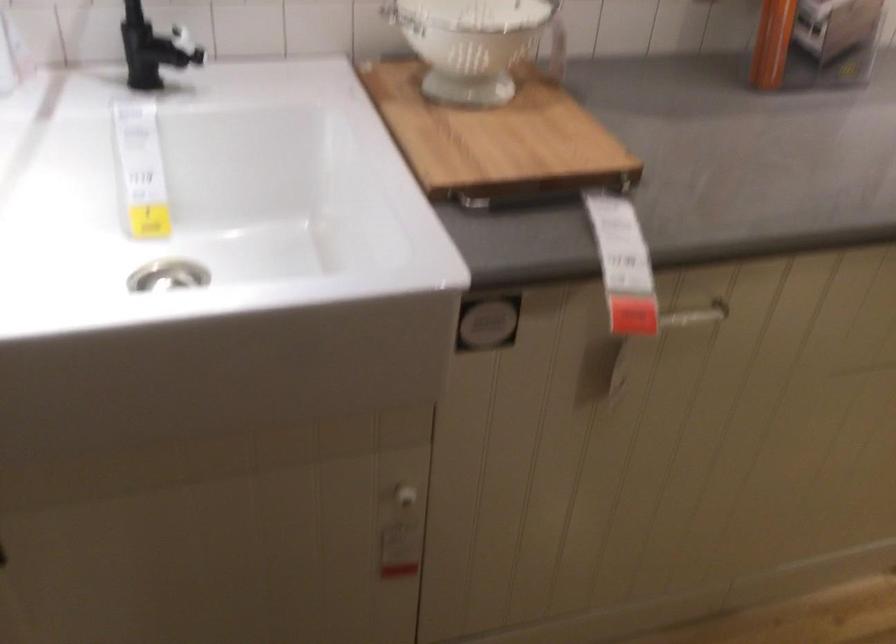
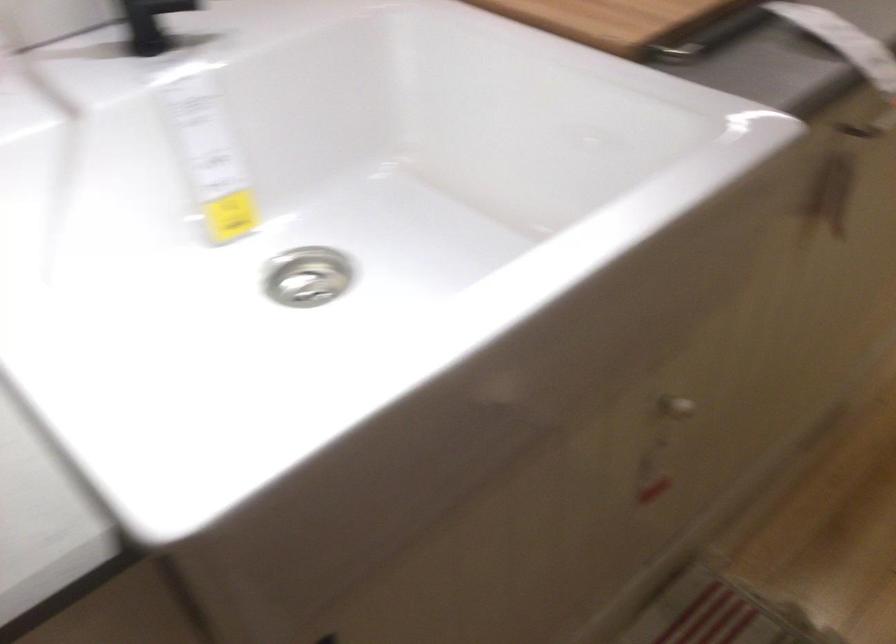
The point at (454, 164) is marked in the first image. Where is the corresponding point in the second image?

(616, 20)